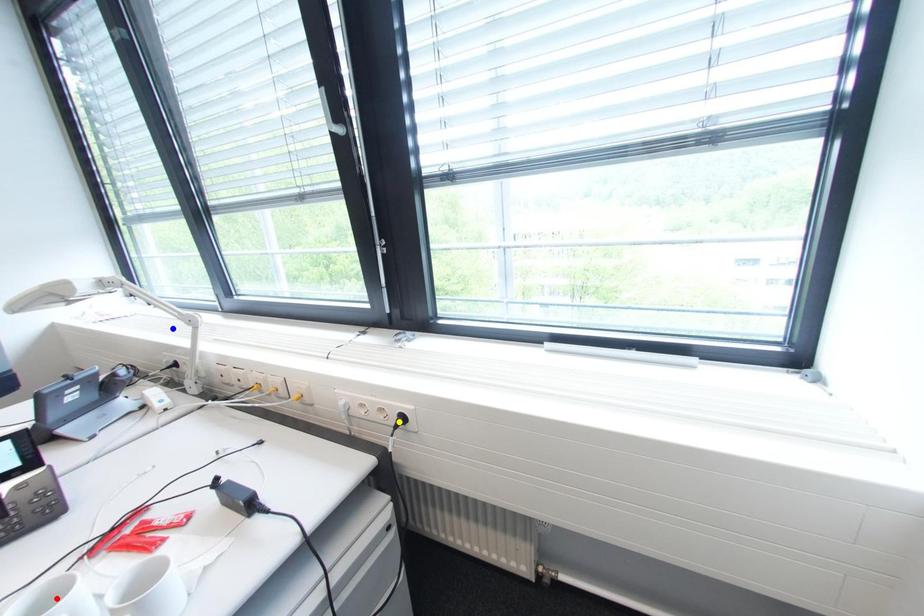
Order these from nearest to farthest:
red point | yellow point | blue point

1. blue point
2. yellow point
3. red point